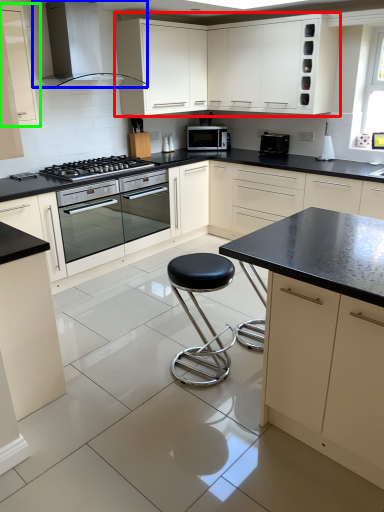
Question: Which is nearer to the cabinetry (highlighted by a red box)? home appliance (highlighted by a blue box) or cabinetry (highlighted by a green box).

Choices:
 (A) home appliance
 (B) cabinetry

Answer: (A)